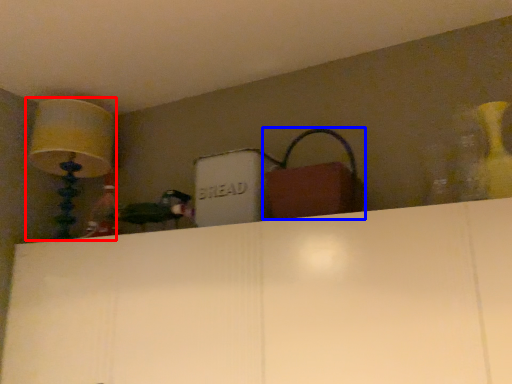
Question: Which object is further to the camera taking this photo, lamp (highlighted by a red box) or handbag (highlighted by a blue box)?

Choices:
 (A) lamp
 (B) handbag

Answer: (A)